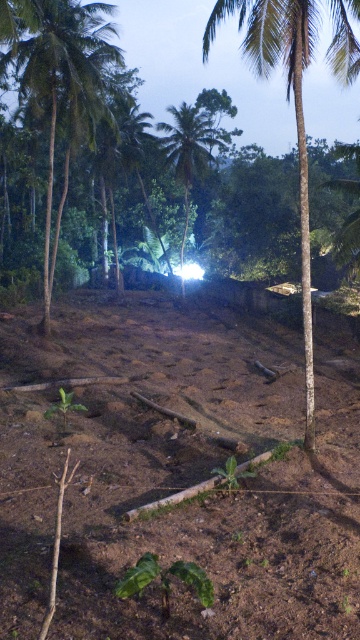
Is point (119, 54) less distant than point (302, 220)?

That is False.

I want to click on green leafy palm tree at left, so click(x=61, y=77).

You are a GUI agent. You are given a task and a screenshot of the screen. Output one action in this format:
    pyautogui.click(x=<x>, y=<y>)
    Task: Click on the green leafy palm tree at left
    The height and width of the screenshot is (640, 360).
    Given the screenshot: What is the action you would take?
    pyautogui.click(x=61, y=77)

Does green leafy palm tree at left have a lesser height compared to green leafy palm tree at center?

Indeed, green leafy palm tree at left has a lesser height compared to green leafy palm tree at center.

Can you confirm if green leafy palm tree at left is thinner than green leafy palm tree at center?

Yes.

Measure the distance between point (88, 104) and camera.

Point (88, 104) and camera are 22.38 meters apart.

At what (x,y) coordinates should I click in order to perform the action: click on green leafy palm tree at left. Please return your answer as a coordinate pair (x, y). This screenshot has height=640, width=360. Looking at the image, I should click on (61, 77).

Locate an element on the screen. Image resolution: width=360 pixels, height=640 pixels. brown soil at center is located at coordinates (177, 472).

Who is more forward, (240, 547) or (187, 176)?

Point (240, 547)

At what (x,y) coordinates should I click in order to perform the action: click on brown soil at center. Please return your answer as a coordinate pair (x, y). The height and width of the screenshot is (640, 360). Looking at the image, I should click on (177, 472).